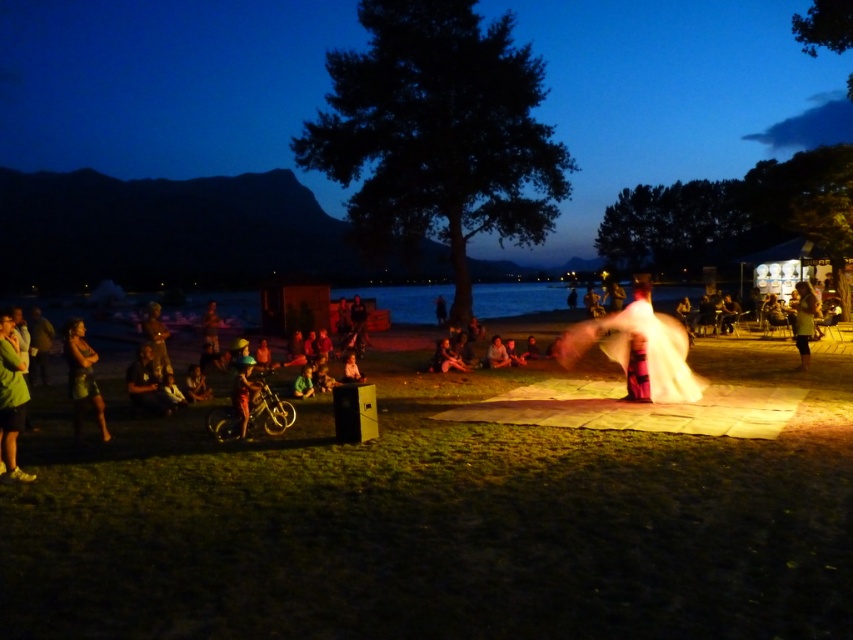
Question: In this image, where is white cotton fabric at center located relative to green fabric jacket at lower left?

Choices:
 (A) above
 (B) below

Answer: (A)

Question: Which of the following is the farthest from the observer?

Choices:
 (A) matte black bicycle at center
 (B) smooth skin person at center
 (C) white cotton fabric at center

Answer: (A)

Question: Does green fabric jacket at lower left have a larger size compared to dark blue fabric at lower left?

Choices:
 (A) yes
 (B) no

Answer: (B)

Question: Is smooth sand beach at center to the left of white cotton dress at right from the viewer's perspective?

Choices:
 (A) no
 (B) yes

Answer: (B)

Question: Considering the real-world distances, which object is farthest from the smooth sand beach at center?

Choices:
 (A) matte black speaker at center
 (B) green fabric jacket at lower left
 (C) bronze statue at center

Answer: (A)

Question: Which object is the farthest from the dark blue fabric at lower left?

Choices:
 (A) matte black speaker at center
 (B) white cotton dress at center

Answer: (A)